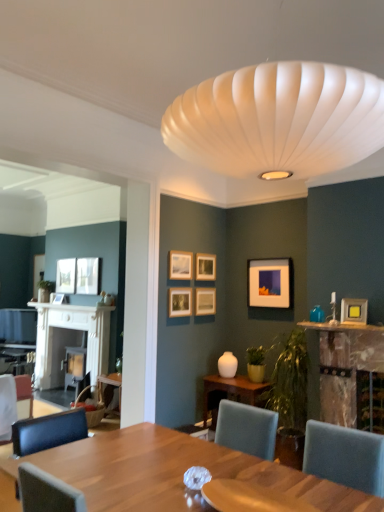
Question: Can you confirm if matte black picture frame at left, the 9th picture frame viewed from the right, is positioned to the left of teal glass vase at upper right?

Choices:
 (A) yes
 (B) no

Answer: (A)

Question: From a real-world perspective, is matte black picture frame at left, the first picture frame from the left, on top of teal glass vase at upper right?

Choices:
 (A) yes
 (B) no

Answer: (A)

Question: Considering the relative sizes of matte black picture frame at left, positioned as the 1th picture frame in back-to-front order, and teal glass vase at upper right in the image provided, is matte black picture frame at left, positioned as the 1th picture frame in back-to-front order, thinner than teal glass vase at upper right?

Choices:
 (A) yes
 (B) no

Answer: (A)

Question: From the image's perspective, does matte black picture frame at left, positioned as the 1th picture frame in back-to-front order, appear lower than teal glass vase at upper right?

Choices:
 (A) yes
 (B) no

Answer: (A)

Question: Is matte black picture frame at left, positioned as the 1th picture frame in back-to-front order, closer to camera compared to teal glass vase at upper right?

Choices:
 (A) yes
 (B) no

Answer: (B)

Question: Looking at their shapes, would you say wooden picture frame at center, the 6th picture frame from the left, is wider or thinner than teal glass vase at upper right?

Choices:
 (A) wide
 (B) thin

Answer: (B)

Question: Is wooden picture frame at center, the 6th picture frame from the left, in front of or behind teal glass vase at upper right in the image?

Choices:
 (A) front
 (B) behind

Answer: (B)

Question: Is point (210, 312) closer or farther from the camera than point (316, 317)?

Choices:
 (A) closer
 (B) farther

Answer: (B)

Question: From a real-world perspective, is wooden picture frame at center, which appears as the fifth picture frame when viewed from the back, physically located above or below teal glass vase at upper right?

Choices:
 (A) above
 (B) below

Answer: (A)

Question: Based on their sizes in the image, would you say matte black picture frame at upper left, the second picture frame positioned from the back, is bigger or smaller than wooden table at center?

Choices:
 (A) small
 (B) big

Answer: (A)

Question: Choose the correct answer: Is matte black picture frame at upper left, which is the second picture frame in left-to-right order, inside wooden table at center or outside it?

Choices:
 (A) outside
 (B) inside

Answer: (A)

Question: In terms of height, does matte black picture frame at upper left, placed as the 8th picture frame when sorted from right to left, look taller or shorter compared to wooden table at center?

Choices:
 (A) tall
 (B) short

Answer: (B)

Question: From a real-world perspective, is matte black picture frame at upper left, positioned as the eighth picture frame in front-to-back order, positioned above or below wooden table at center?

Choices:
 (A) below
 (B) above

Answer: (B)

Question: From the image's perspective, is white wood fireplace at left, arranged as the 2th fireplace when viewed from the right, located above or below rustic wood fireplace at right, which is the 2th fireplace from back to front?

Choices:
 (A) above
 (B) below

Answer: (B)

Question: Is white wood fireplace at left, which is counted as the first fireplace, starting from the left, in front of or behind rustic wood fireplace at right, marked as the 2th fireplace in a left-to-right arrangement, in the image?

Choices:
 (A) front
 (B) behind

Answer: (B)